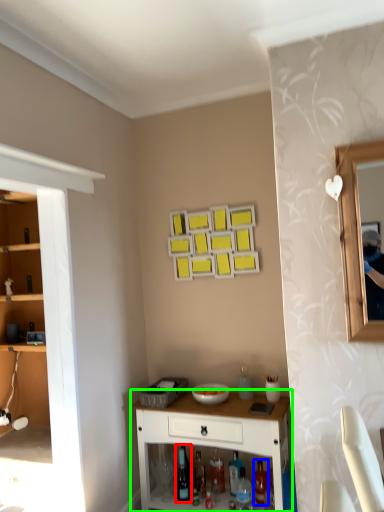
Question: Estimate the real-world distances between objects in this image. Which object is farther from wine bottle (highlighted by a red box), bottle (highlighted by a blue box) or desk (highlighted by a green box)?

Choices:
 (A) bottle
 (B) desk

Answer: (A)